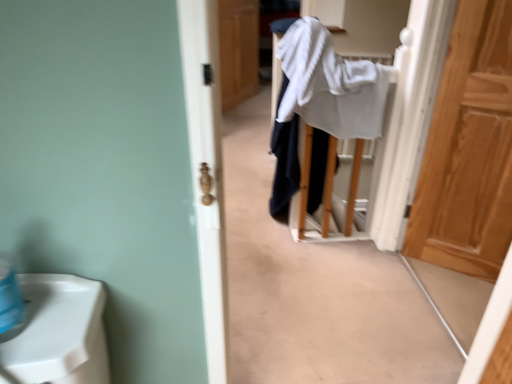
Question: Is white cotton bath towel at center completely or partially inside wooden door at center, placed as the 2th door when sorted from bottom to top?

Choices:
 (A) yes
 (B) no

Answer: (B)

Question: Is wooden door at center, the first door positioned from the back, positioned beyond the bounds of white cotton bath towel at center?

Choices:
 (A) yes
 (B) no

Answer: (A)

Question: Does wooden door at center, the first door positioned from the left, turn towards white cotton bath towel at center?

Choices:
 (A) no
 (B) yes

Answer: (A)

Question: From the image's perspective, is wooden door at center, arranged as the first door when viewed from the top, under white cotton bath towel at center?

Choices:
 (A) yes
 (B) no

Answer: (B)

Question: Is the position of wooden door at center, the first door positioned from the back, more distant than that of white cotton bath towel at center?

Choices:
 (A) no
 (B) yes

Answer: (B)

Question: Is white cotton bath towel at center taller or shorter than wooden door at center, the second door from the right?

Choices:
 (A) tall
 (B) short

Answer: (B)

Question: From the image's perspective, is white cotton bath towel at center above or below wooden door at center, arranged as the first door when viewed from the top?

Choices:
 (A) below
 (B) above

Answer: (A)

Question: Choose the correct answer: Is white cotton bath towel at center inside wooden door at center, the 2th door from the front, or outside it?

Choices:
 (A) inside
 (B) outside

Answer: (B)

Question: Considering their positions, is white cotton bath towel at center located in front of or behind wooden door at center, placed as the 2th door when sorted from bottom to top?

Choices:
 (A) behind
 (B) front

Answer: (B)

Question: From the image's perspective, is light brown wood door at right, the 2th door when ordered from left to right, positioned above or below wooden door at center, the first door positioned from the left?

Choices:
 (A) below
 (B) above

Answer: (A)

Question: Is light brown wood door at right, the first door from the right, taller or shorter than wooden door at center, the 2th door from the front?

Choices:
 (A) tall
 (B) short

Answer: (A)

Question: Is light brown wood door at right, acting as the 1th door starting from the bottom, situated inside wooden door at center, the second door from the right, or outside?

Choices:
 (A) outside
 (B) inside

Answer: (A)

Question: Considering the positions of light brown wood door at right, which appears as the second door when viewed from the top, and wooden door at center, placed as the 2th door when sorted from bottom to top, in the image, is light brown wood door at right, which appears as the second door when viewed from the top, bigger or smaller than wooden door at center, placed as the 2th door when sorted from bottom to top,?

Choices:
 (A) small
 (B) big

Answer: (A)

Question: Does point (221, 36) appear closer or farther from the camera than point (355, 107)?

Choices:
 (A) farther
 (B) closer

Answer: (A)

Question: Is wooden door at center, the first door positioned from the left, to the left or to the right of white cotton bath towel at center in the image?

Choices:
 (A) right
 (B) left

Answer: (B)